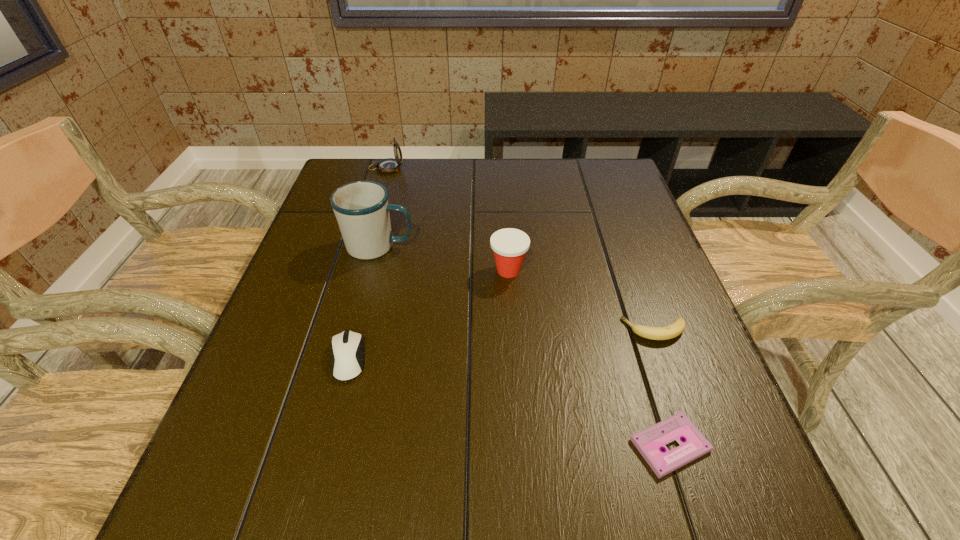
The width and height of the screenshot is (960, 540). Find the location of `banana located in the right edge section of the desktop`. banana located in the right edge section of the desktop is located at coordinates (673, 330).

In order to click on videotape that is at the right edge in this screenshot , I will do `click(649, 442)`.

I want to click on object located in the far left corner section of the desktop, so click(390, 165).

Where is `object positioned at the near right corner`? The width and height of the screenshot is (960, 540). object positioned at the near right corner is located at coordinates (649, 442).

Find the location of a particular element. free space at the far edge of the desktop is located at coordinates pos(495,166).

In the image, there is a desktop. Identify the location of vacant area at the near edge. The image size is (960, 540). (610, 507).

In the image, there is a desktop. What are the coordinates of `vacant area at the left edge` in the screenshot? It's located at (248, 461).

Find the location of a particular element. vacant region at the right edge of the desktop is located at coordinates (610, 236).

Image resolution: width=960 pixels, height=540 pixels. I want to click on vacant space at the near left corner of the desktop, so click(x=178, y=522).

Where is `vacant space at the far right corner of the desktop`? vacant space at the far right corner of the desktop is located at coordinates (617, 168).